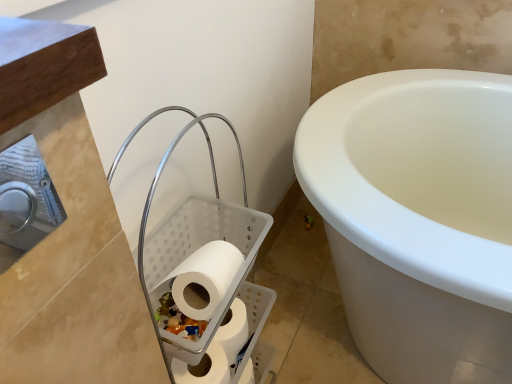
Question: Considering the relative positions of white matte toilet paper at center, which is the first toilet paper in top-to-bottom order, and white matte toilet paper at lower center, arranged as the 2th toilet paper when viewed from the top, in the image provided, is white matte toilet paper at center, which is the first toilet paper in top-to-bottom order, to the right of white matte toilet paper at lower center, arranged as the 2th toilet paper when viewed from the top, from the viewer's perspective?

Choices:
 (A) no
 (B) yes

Answer: (B)

Question: From the image's perspective, would you say white matte toilet paper at center, placed as the third toilet paper when sorted from bottom to top, is positioned over white matte toilet paper at lower center, the 2th toilet paper when ordered from bottom to top?

Choices:
 (A) no
 (B) yes

Answer: (B)

Question: Is white matte toilet paper at center, which is the first toilet paper in top-to-bottom order, facing towards white matte toilet paper at lower center, arranged as the 2th toilet paper when viewed from the top?

Choices:
 (A) no
 (B) yes

Answer: (A)

Question: From a real-world perspective, is white matte toilet paper at center, which is the first toilet paper in top-to-bottom order, physically above white matte toilet paper at lower center, the 2th toilet paper when ordered from bottom to top?

Choices:
 (A) no
 (B) yes

Answer: (B)

Question: Considering the relative sizes of white matte toilet paper at center, which is the first toilet paper in top-to-bottom order, and white matte toilet paper at lower center, arranged as the 2th toilet paper when viewed from the top, in the image provided, is white matte toilet paper at center, which is the first toilet paper in top-to-bottom order, shorter than white matte toilet paper at lower center, arranged as the 2th toilet paper when viewed from the top,?

Choices:
 (A) no
 (B) yes

Answer: (B)

Question: From the image's perspective, is white matte toilet paper at center, placed as the third toilet paper when sorted from bottom to top, located above or below white plastic laundry basket at upper left?

Choices:
 (A) above
 (B) below

Answer: (A)

Question: Does point (205, 251) appear closer or farther from the camera than point (200, 276)?

Choices:
 (A) farther
 (B) closer

Answer: (A)

Question: In terms of height, does white matte toilet paper at center, placed as the third toilet paper when sorted from bottom to top, look taller or shorter compared to white plastic laundry basket at upper left?

Choices:
 (A) tall
 (B) short

Answer: (B)

Question: Choose the correct answer: Is white matte toilet paper at center, which is the first toilet paper in top-to-bottom order, inside white plastic laundry basket at upper left or outside it?

Choices:
 (A) outside
 (B) inside

Answer: (B)

Question: From a real-world perspective, is white matte toilet paper at lower center, which appears as the third toilet paper when viewed from the top, above or below white matte toilet paper at lower center, the 2th toilet paper when ordered from bottom to top?

Choices:
 (A) below
 (B) above

Answer: (A)

Question: Would you say white matte toilet paper at lower center, arranged as the first toilet paper when ordered from the bottom, is inside or outside white matte toilet paper at lower center, the 2th toilet paper when ordered from bottom to top?

Choices:
 (A) inside
 (B) outside

Answer: (B)

Question: Is point (175, 362) closer or farther from the camera than point (218, 332)?

Choices:
 (A) closer
 (B) farther

Answer: (A)

Question: From their relative heights in the image, would you say white matte toilet paper at lower center, which appears as the third toilet paper when viewed from the top, is taller or shorter than white matte toilet paper at lower center, arranged as the 2th toilet paper when viewed from the top?

Choices:
 (A) tall
 (B) short

Answer: (A)

Question: Based on their positions, is white plastic laundry basket at upper left located to the left or right of white matte toilet paper at lower center, arranged as the first toilet paper when ordered from the bottom?

Choices:
 (A) left
 (B) right

Answer: (B)

Question: Is point (241, 314) closer or farther from the camera than point (178, 367)?

Choices:
 (A) farther
 (B) closer

Answer: (A)